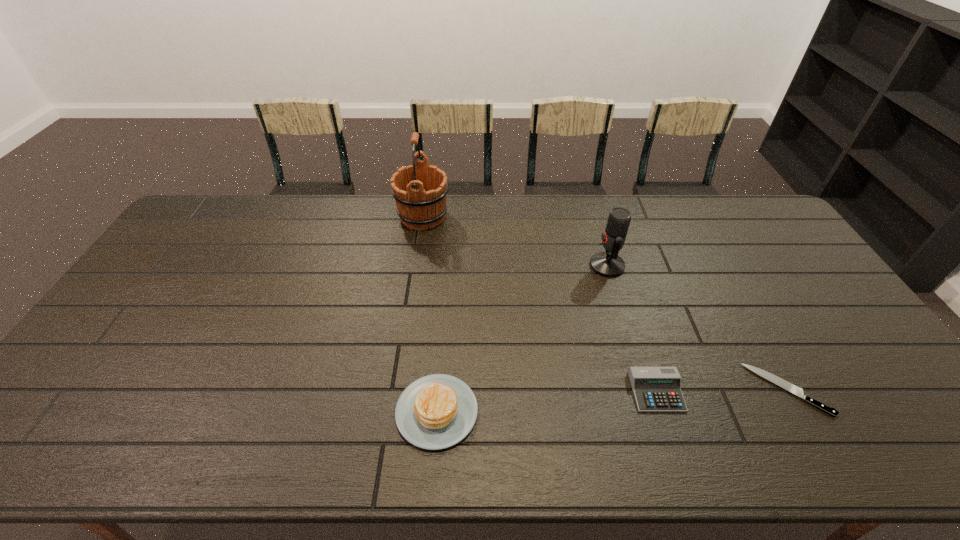
You are a GUI agent. You are given a task and a screenshot of the screen. Output one action in this format:
    pyautogui.click(x=<x>, y=<y>)
    Task: Click on the empty space that is in between the wine bucket and the steak knife
    Image resolution: width=960 pixels, height=540 pixels.
    Given the screenshot: What is the action you would take?
    pyautogui.click(x=605, y=303)

Select which object appears as the fourth closest to the fourth nearest object. Please provide its 2D coordinates. Your answer should be formatted as a tuple, i.e. [(x, y)], where the tuple contains the x and y coordinates of a point satisfying the conditions above.

[(437, 411)]

Locate an element on the screen. The width and height of the screenshot is (960, 540). object that can be found as the closest to the third shortest object is located at coordinates (656, 389).

This screenshot has height=540, width=960. I want to click on free point that satisfies the following two spatial constraints: 1. on the side of the rightmost object with the red ring; 2. on the left side of the microphone, so click(x=644, y=389).

Identify the location of vacant position in the image that satisfies the following two spatial constraints: 1. on the side of the microphone with the red ring; 2. on the back side of the second shortest object. (644, 392).

Find the location of a particular element. This screenshot has height=540, width=960. vacant space that satisfies the following two spatial constraints: 1. on the back side of the rightmost object; 2. on the left side of the third tallest object is located at coordinates (439, 389).

What are the coordinates of `vacant area that satisfies the following two spatial constraints: 1. on the side of the second farthest object with the red ring; 2. on the right side of the steak knife` in the screenshot? It's located at click(644, 389).

Identify the location of free spot that satisfies the following two spatial constraints: 1. on the side of the microphone with the red ring; 2. on the right side of the calculator. The width and height of the screenshot is (960, 540). (644, 392).

At what (x,y) coordinates should I click in order to perform the action: click on vacant region that satisfies the following two spatial constraints: 1. on the back side of the pancake; 2. on the left side of the fourth tallest object. Please return your answer as a coordinate pair (x, y). Looking at the image, I should click on (439, 392).

Locate an element on the screen. This screenshot has width=960, height=540. vacant area that satisfies the following two spatial constraints: 1. on the side of the second farthest object with the red ring; 2. on the front side of the pancake is located at coordinates (650, 411).